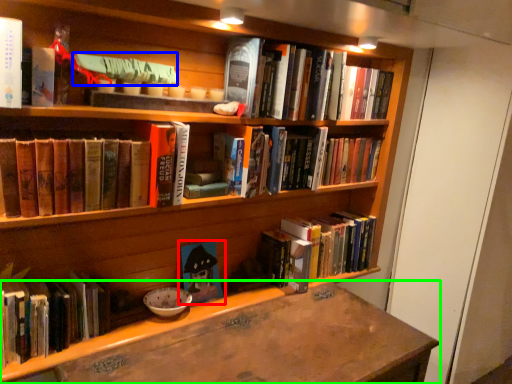
Question: Estimate the real-world distances between objects in this image. Which object is closer to book (highlighted by a red box), book (highlighted by a blue box) or desk (highlighted by a green box)?

Choices:
 (A) book
 (B) desk

Answer: (B)